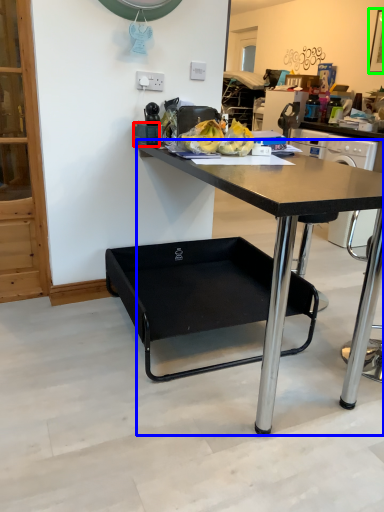
Question: Which object is the farthest from tableware (highlighted by a red box)? Choose among these: desk (highlighted by a blue box) or picture frame (highlighted by a green box).

Choices:
 (A) desk
 (B) picture frame

Answer: (B)